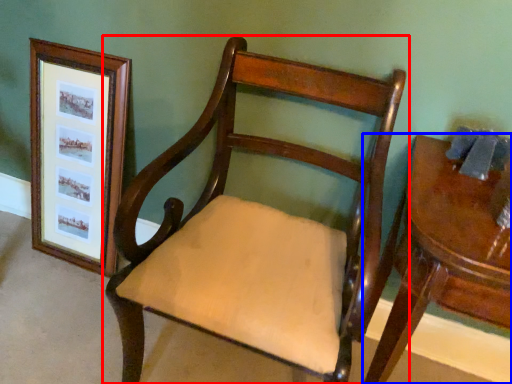
Question: Among these objects, which one is nearest to the camera, chair (highlighted by a red box) or table (highlighted by a blue box)?

Choices:
 (A) chair
 (B) table

Answer: (A)